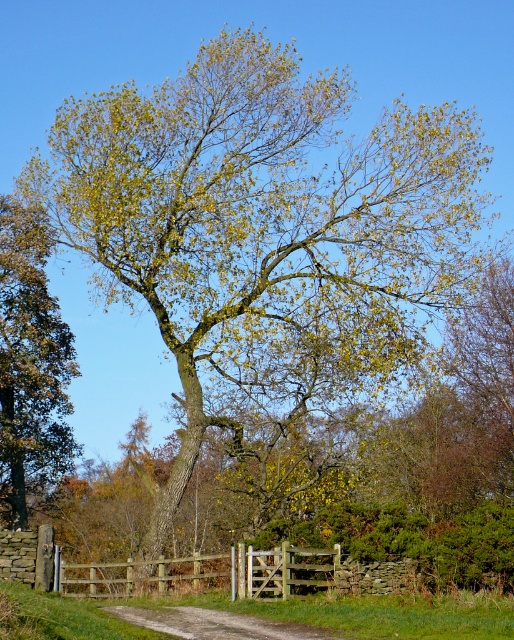
Does wooden gate at center have a smaller size compared to dirt/gravel path at center?

No.

Can you confirm if wooden gate at center is positioned to the right of dirt/gravel path at center?

No, wooden gate at center is not to the right of dirt/gravel path at center.

Is point (295, 586) farther from viewer compared to point (175, 628)?

Yes, point (295, 586) is farther from viewer.

The width and height of the screenshot is (514, 640). Find the location of `wooden gate at center`. wooden gate at center is located at coordinates (241, 573).

Between green leafy tree at left and dirt/gravel path at center, which one appears on the left side from the viewer's perspective?

green leafy tree at left is more to the left.

In the scene shown: Is green leafy tree at left to the left of dirt/gravel path at center from the viewer's perspective?

Correct, you'll find green leafy tree at left to the left of dirt/gravel path at center.

Does point (43, 244) lie behind point (158, 612)?

Yes, point (43, 244) is farther from viewer.

You are a GUI agent. You are given a task and a screenshot of the screen. Output one action in this format:
    pyautogui.click(x=<x>, y=<y>)
    Task: Click on the green leafy tree at left
    
    Given the screenshot: What is the action you would take?
    pyautogui.click(x=30, y=362)

Does green leafy tree at left have a lesser height compared to wooden gate at center?

No.

Based on the photo, can you confirm if green leafy tree at left is smaller than wooden gate at center?

Incorrect, green leafy tree at left is not smaller in size than wooden gate at center.

Locate an element on the screen. green leafy tree at left is located at coordinates (30, 362).